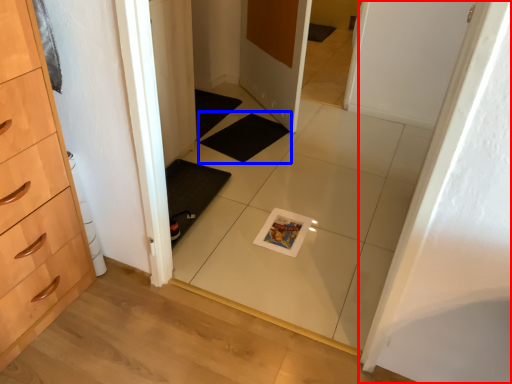
Question: Among these objects, which one is farthest to the camera, door (highlighted by a red box) or bath mat (highlighted by a blue box)?

Choices:
 (A) door
 (B) bath mat

Answer: (B)